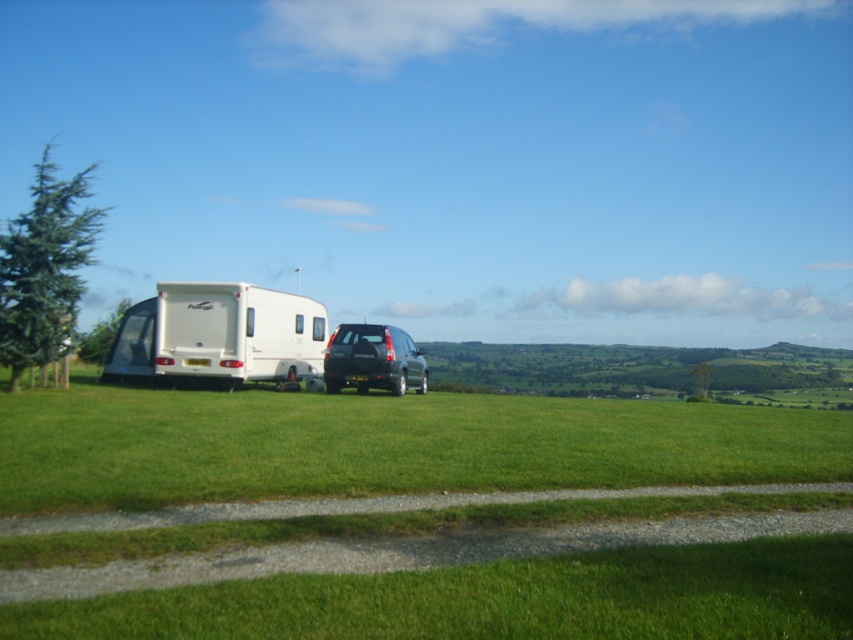
Question: Estimate the real-world distances between objects in this image. Which object is closer to the white glossy camper at left?

Choices:
 (A) black plastic license plate at center
 (B) satin black suv at center

Answer: (B)

Question: Is the position of satin black suv at center more distant than that of black plastic license plate at center?

Choices:
 (A) yes
 (B) no

Answer: (B)

Question: Which object is farther from the camera taking this photo?

Choices:
 (A) white glossy camper at left
 (B) black plastic license plate at center
 (C) satin black suv at center

Answer: (A)

Question: Does white glossy camper at left come in front of satin black suv at center?

Choices:
 (A) yes
 (B) no

Answer: (B)

Question: Which object is closer to the camera taking this photo?

Choices:
 (A) black plastic license plate at center
 (B) satin black suv at center
 (C) white glossy camper at left

Answer: (B)

Question: Can you confirm if white glossy camper at left is thinner than black plastic license plate at center?

Choices:
 (A) yes
 (B) no

Answer: (B)